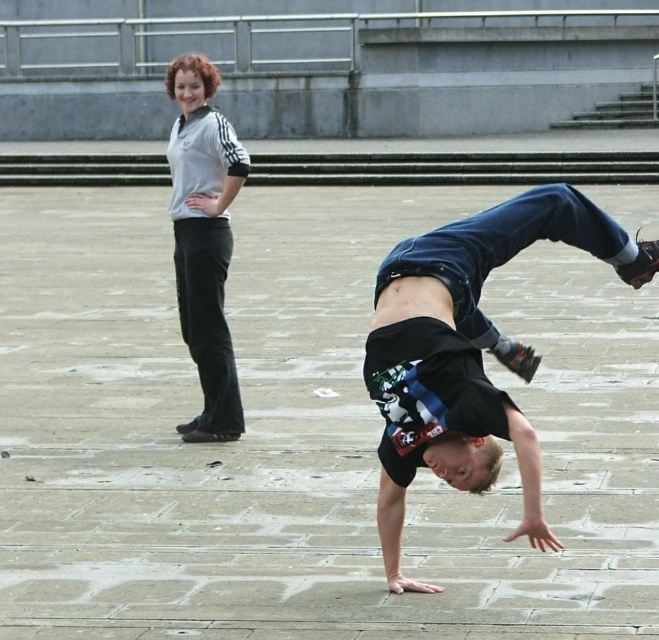
Question: Among these objects, which one is farthest from the camera?

Choices:
 (A) white matte pants at upper left
 (B) black cotton shirt at center

Answer: (A)

Question: Which of the following is the farthest from the observer?

Choices:
 (A) (496, 208)
 (B) (186, 438)

Answer: (B)

Question: Does black cotton shirt at center appear on the left side of white matte pants at upper left?

Choices:
 (A) yes
 (B) no

Answer: (B)

Question: Is black cotton shirt at center thinner than white matte pants at upper left?

Choices:
 (A) yes
 (B) no

Answer: (B)

Question: Which point is farther to the camera?

Choices:
 (A) (204, 237)
 (B) (459, 419)

Answer: (A)

Question: Is black cotton shirt at center to the left of white matte pants at upper left from the viewer's perspective?

Choices:
 (A) yes
 (B) no

Answer: (B)